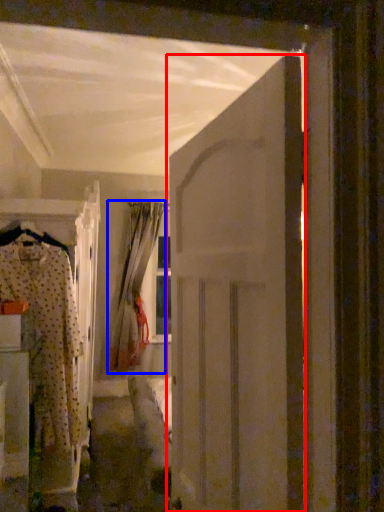
Question: Which of the following is the farthest to the observer, door (highlighted by a red box) or curtain (highlighted by a blue box)?

Choices:
 (A) door
 (B) curtain

Answer: (B)